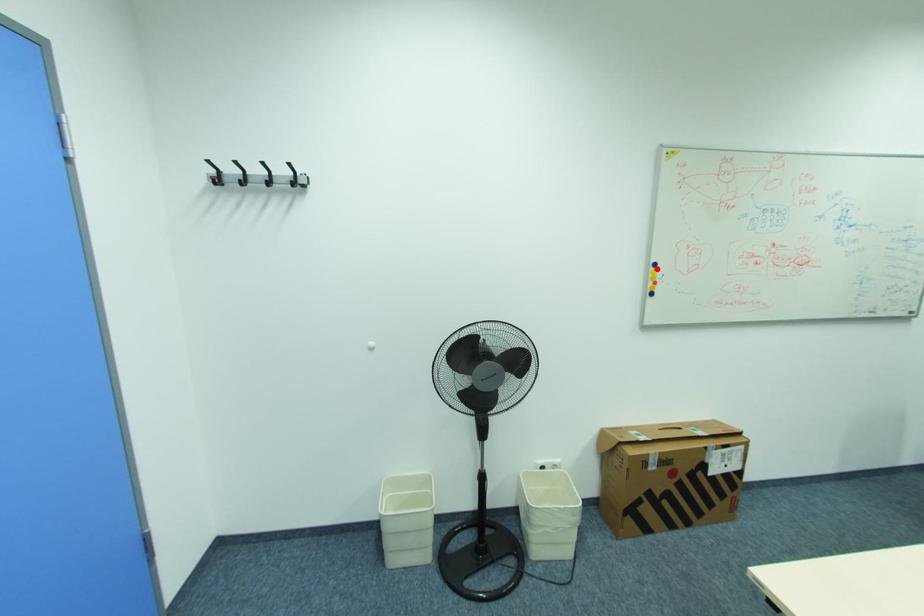
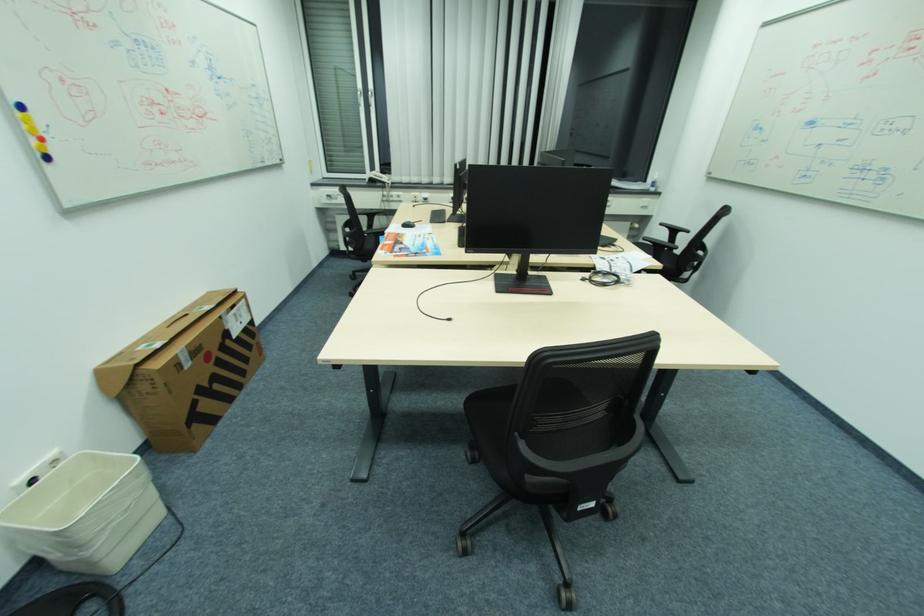
Find the pixel in the second image that matches the highlighted location in the first image.

(21, 114)